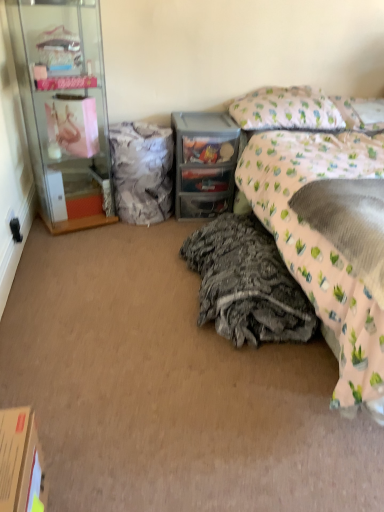
What is the approximate width of translucent plastic drawer at center?

translucent plastic drawer at center is 18.62 inches wide.

Find the location of `clear glass cabinet at left`. clear glass cabinet at left is located at coordinates (64, 109).

The image size is (384, 512). I want to click on light pink fabric pillow at upper right, positioned as the first pillow in left-to-right order, so click(286, 110).

What do you see at coordinates (315, 229) in the screenshot?
I see `floral fabric bed at right` at bounding box center [315, 229].

Where is `translucent plastic drawer at center`? translucent plastic drawer at center is located at coordinates (204, 163).

Based on the photo, are translucent plastic drawer at center and textured gray blanket at lower center, placed as the first material when sorted from front to back, located far from each other?

translucent plastic drawer at center is near textured gray blanket at lower center, placed as the first material when sorted from front to back, not far away.

Which is closer, (213, 140) or (211, 224)?

Point (213, 140) is positioned farther from the camera compared to point (211, 224).

Is translucent plastic drawer at center to the left of textured gray blanket at lower center, which ranks as the second material in top-to-bottom order, from the viewer's perspective?

Correct, you'll find translucent plastic drawer at center to the left of textured gray blanket at lower center, which ranks as the second material in top-to-bottom order.

From the image's perspective, is translucent plastic drawer at center located above textured gray blanket at lower center, which is the second material in left-to-right order?

Yes, from the image's perspective, translucent plastic drawer at center is above textured gray blanket at lower center, which is the second material in left-to-right order.

Looking at their sizes, would you say black plastic power outlet at lower left is wider or thinner than translucent plastic drawer at center?

black plastic power outlet at lower left is thinner than translucent plastic drawer at center.

Visually, is black plastic power outlet at lower left positioned to the left or to the right of translucent plastic drawer at center?

From the image, it's evident that black plastic power outlet at lower left is to the left of translucent plastic drawer at center.

Can you confirm if black plastic power outlet at lower left is taller than translucent plastic drawer at center?

Incorrect, the height of black plastic power outlet at lower left is not larger of that of translucent plastic drawer at center.

Is translucent plastic drawer at center at the back of black plastic power outlet at lower left?

That's not correct — black plastic power outlet at lower left is not looking away from translucent plastic drawer at center.

Is floral fabric bed at right located within white textured fabric at center, arranged as the 2th material when ordered from the bottom?

That's incorrect, floral fabric bed at right is not inside white textured fabric at center, arranged as the 2th material when ordered from the bottom.

Is white textured fabric at center, which is the second material in front-to-back order, aimed at floral fabric bed at right?

No, white textured fabric at center, which is the second material in front-to-back order, is not turned towards floral fabric bed at right.

From the image's perspective, between white textured fabric at center, arranged as the 2th material when ordered from the bottom, and floral fabric bed at right, who is located below?

From the image's view, floral fabric bed at right is below.

Which of these two, translucent plastic drawer at center or cardboard box at lower left, is thinner?

cardboard box at lower left.

Do you think translucent plastic drawer at center is within cardboard box at lower left, or outside of it?

translucent plastic drawer at center is outside cardboard box at lower left.

In the scene shown: Is translucent plastic drawer at center further to camera compared to cardboard box at lower left?

Yes.

Does point (235, 151) lie behind point (11, 437)?

Yes, point (235, 151) is farther from viewer.

Is point (351, 182) behind point (8, 490)?

Yes, point (351, 182) is behind point (8, 490).

From a real-world perspective, relative to cardboard box at lower left, is floral fabric bed at right vertically above or below?

floral fabric bed at right is situated higher than cardboard box at lower left in the real world.

The height and width of the screenshot is (512, 384). I want to click on box on the left of floral fabric bed at right, so click(x=21, y=462).

How far apart are floral fabric bed at right and cardboard box at lower left?

They are 1.47 meters apart.

Between clear glass cabinet at left and light pink fabric pillow at upper right, positioned as the first pillow in left-to-right order, which one appears on the right side from the viewer's perspective?

From the viewer's perspective, light pink fabric pillow at upper right, positioned as the first pillow in left-to-right order, appears more on the right side.

Does point (85, 139) come closer to viewer compared to point (248, 119)?

Yes, it is in front of point (248, 119).

Considering the sizes of objects clear glass cabinet at left and light pink fabric pillow at upper right, which ranks as the 2th pillow in right-to-left order, in the image provided, who is bigger, clear glass cabinet at left or light pink fabric pillow at upper right, which ranks as the 2th pillow in right-to-left order,?

With larger size is clear glass cabinet at left.

Does clear glass cabinet at left have a greater height compared to light pink fabric pillow at upper right, positioned as the first pillow in left-to-right order?

Indeed, clear glass cabinet at left has a greater height compared to light pink fabric pillow at upper right, positioned as the first pillow in left-to-right order.

Looking at this image, could you tell me if textured gray blanket at lower center, which is the second material in back-to-front order, is turned towards pink fabric at right?

No.

Is textured gray blanket at lower center, which ranks as the second material in top-to-bottom order, far from pink fabric at right?

No.

Is textured gray blanket at lower center, placed as the first material when sorted from front to back, further to the viewer compared to pink fabric at right?

That is True.

Which of these two, textured gray blanket at lower center, which ranks as the second material in top-to-bottom order, or pink fabric at right, stands taller?

Result: textured gray blanket at lower center, which ranks as the second material in top-to-bottom order, is taller.

Locate an element on the screen. desk that is on the left side of textured gray blanket at lower center, placed as the first material when sorted from front to back is located at coordinates (204, 163).

In order to click on desk above the black plastic power outlet at lower left (from the image's perspective) in this screenshot , I will do `click(204, 163)`.

From the image, which object appears to be nearer to white fabric pillow at upper right, which is counted as the 2th pillow, starting from the left, cardboard box at lower left or white textured fabric at center, arranged as the 2th material when ordered from the bottom?

white textured fabric at center, arranged as the 2th material when ordered from the bottom, is closer to white fabric pillow at upper right, which is counted as the 2th pillow, starting from the left.

When comparing their distances from clear glass cabinet at left, does light pink fabric pillow at upper right, which ranks as the 2th pillow in right-to-left order, or black plastic power outlet at lower left seem further?

Based on the image, light pink fabric pillow at upper right, which ranks as the 2th pillow in right-to-left order, appears to be further to clear glass cabinet at left.

When comparing their distances from textured gray blanket at lower center, placed as the first material when sorted from front to back, does pink fabric at right or white textured fabric at center, the first material positioned from the top, seem further?

Among the two, white textured fabric at center, the first material positioned from the top, is located further to textured gray blanket at lower center, placed as the first material when sorted from front to back.

From the image, which object appears to be farther from cardboard box at lower left, black plastic power outlet at lower left or clear glass cabinet at left?

Among the two, clear glass cabinet at left is located further to cardboard box at lower left.

When comparing their distances from cardboard box at lower left, does black plastic power outlet at lower left or white fabric pillow at upper right, which is the first pillow from right to left, seem closer?

black plastic power outlet at lower left.

Estimate the real-world distances between objects in this image. Which object is closer to black plastic power outlet at lower left, translucent plastic drawer at center or clear glass cabinet at left?

Among the two, clear glass cabinet at left is located nearer to black plastic power outlet at lower left.

Considering their positions, is textured gray blanket at lower center, which is the second material in back-to-front order, positioned further to clear glass cabinet at left than black plastic power outlet at lower left?

The object further to clear glass cabinet at left is textured gray blanket at lower center, which is the second material in back-to-front order.

Considering their positions, is textured gray blanket at lower center, which is the second material in left-to-right order, positioned closer to white textured fabric at center, which is the first material from back to front, than translucent plastic drawer at center?

translucent plastic drawer at center is positioned closer to the anchor white textured fabric at center, which is the first material from back to front.

At what (x,y) coordinates should I click in order to perform the action: click on sheet situated between black plastic power outlet at lower left and white fabric pillow at upper right, which is the first pillow from right to left, from left to right. Please return your answer as a coordinate pair (x, y). Looking at the image, I should click on (349, 223).

Locate an element on the screen. This screenshot has width=384, height=512. power outlet between cardboard box at lower left and translucent plastic drawer at center in the front-back direction is located at coordinates (16, 230).

The width and height of the screenshot is (384, 512). What are the coordinates of `material positioned between cardboard box at lower left and black plastic power outlet at lower left from near to far` in the screenshot? It's located at (247, 283).

Identify the location of pillow between pink fabric at right and white fabric pillow at upper right, which is counted as the 2th pillow, starting from the left, from front to back. Image resolution: width=384 pixels, height=512 pixels. (286, 110).